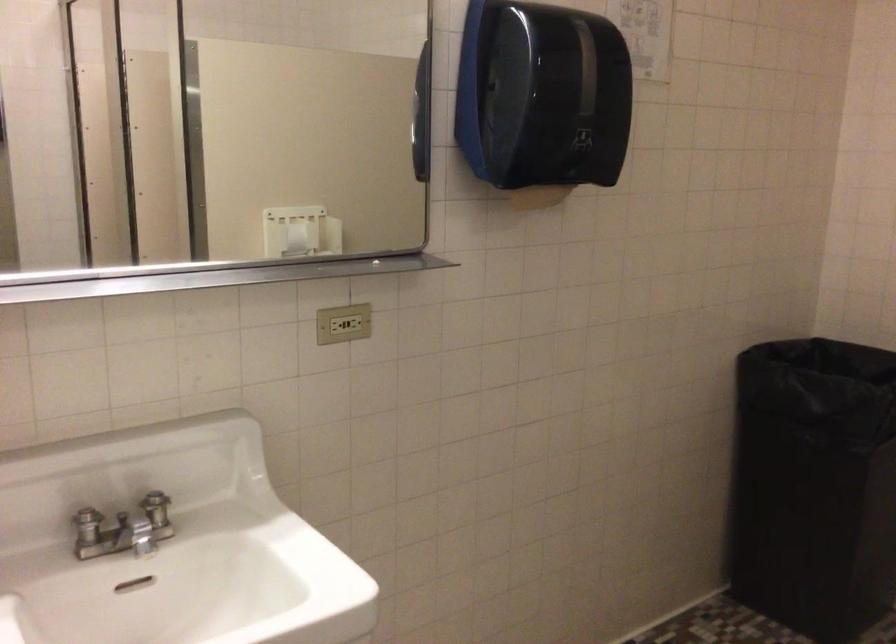
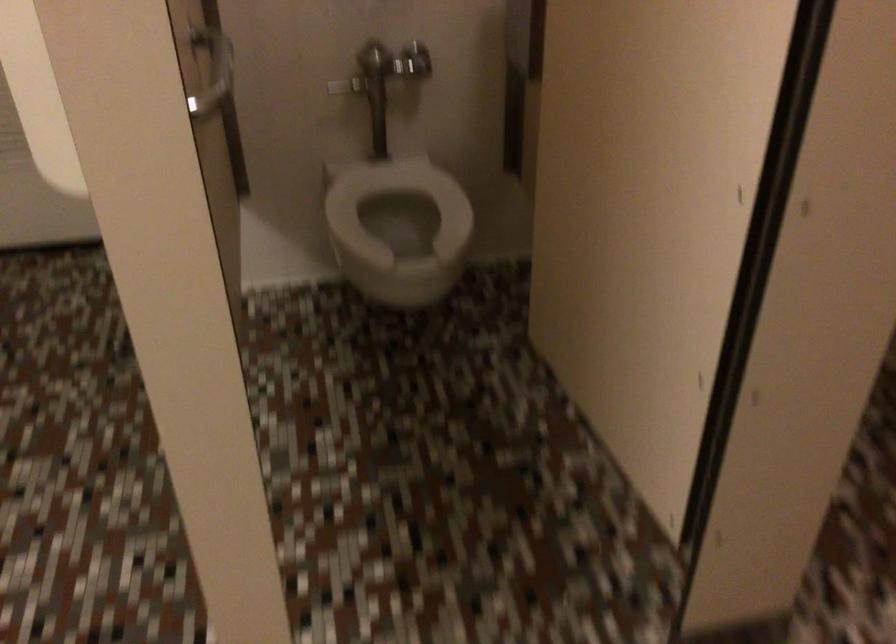
How did the camera likely rotate?

The rotation direction of the camera is right-down.